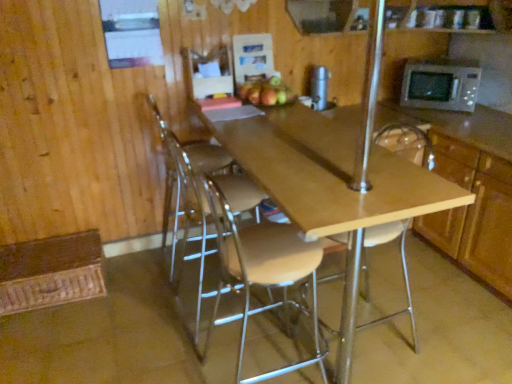
Image resolution: width=512 pixels, height=384 pixels. I want to click on vacant space in front of clear plastic chair at center, which is the third chair from right to left, so click(159, 300).